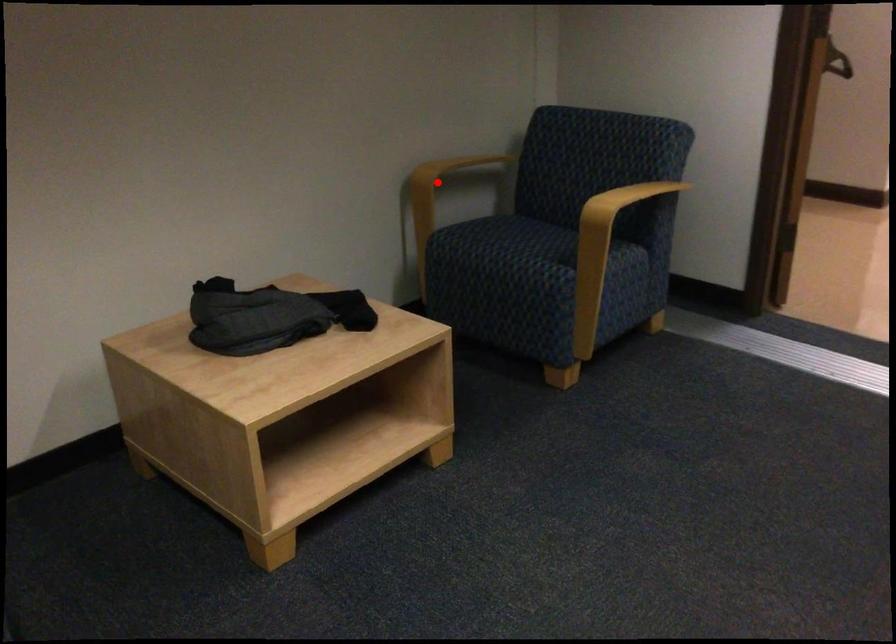
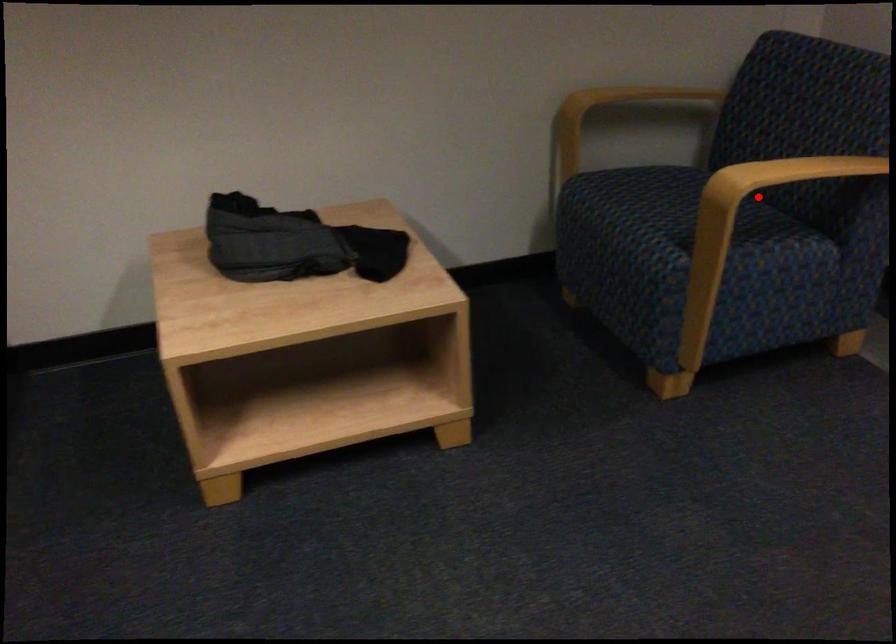
I am providing you with two images of the same scene from different viewpoints. A red point is marked on the first image and another point is marked on the second image. Is the red point in image1 aligned with the point shown in image2?

No